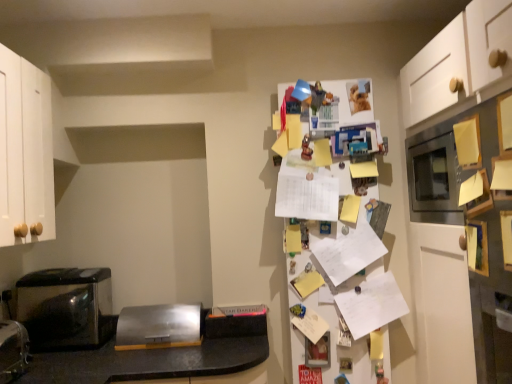
What do you see at coordinates (66, 308) in the screenshot? The image size is (512, 384). I see `metallic black toaster at left` at bounding box center [66, 308].

The width and height of the screenshot is (512, 384). I want to click on white paper covered fridge at upper right, so click(x=339, y=259).

Is point (358, 368) farther from viewer compared to point (16, 358)?

Yes, it is behind point (16, 358).

From the image's perspective, between white paper covered fridge at upper right and black stainless steel microwave at lower left, marked as the 2th appliance in a right-to-left arrangement, which one is located above?

From the image's view, white paper covered fridge at upper right is above.

Is white paper covered fridge at upper right outside of black stainless steel microwave at lower left, positioned as the first appliance in left-to-right order?

Yes.

How much distance is there between satin silver toaster at center, arranged as the first appliance when viewed from the right, and metallic black toaster at left?

satin silver toaster at center, arranged as the first appliance when viewed from the right, is 11.89 inches away from metallic black toaster at left.

From a real-world perspective, which object rests below the other?

In real-world perspective, satin silver toaster at center, which appears as the first appliance when viewed from the back, is lower.

Is satin silver toaster at center, the 2th appliance positioned from the front, bigger or smaller than metallic black toaster at left?

satin silver toaster at center, the 2th appliance positioned from the front, is smaller than metallic black toaster at left.

Is satin silver toaster at center, which is the second appliance from left to right, inside the boundaries of metallic black toaster at left, or outside?

The correct answer is: outside.

Are white paper at center and white paper covered fridge at upper right far apart?

Actually, white paper at center and white paper covered fridge at upper right are a little close together.

Can you confirm if white paper at center is thinner than white paper covered fridge at upper right?

Correct, the width of white paper at center is less than that of white paper covered fridge at upper right.

From a real-world perspective, is white paper at center beneath white paper covered fridge at upper right?

Yes.

Is black stainless steel microwave at lower left, marked as the 2th appliance in a right-to-left arrangement, aimed at metallic black toaster at left?

No, black stainless steel microwave at lower left, marked as the 2th appliance in a right-to-left arrangement, is not oriented towards metallic black toaster at left.

Locate an element on the screen. This screenshot has height=384, width=512. home appliance that is above the black stainless steel microwave at lower left, positioned as the first appliance in left-to-right order (from the image's perspective) is located at coordinates coord(66,308).

Is point (2, 377) closer or farther from the camera than point (105, 287)?

Clearly, point (2, 377) is closer to the camera than point (105, 287).

Looking at their sizes, would you say black stainless steel microwave at lower left, the 1th appliance in the front-to-back sequence, is wider or thinner than metallic black toaster at left?

Clearly, black stainless steel microwave at lower left, the 1th appliance in the front-to-back sequence, has less width compared to metallic black toaster at left.

Is black stainless steel microwave at lower left, positioned as the first appliance in left-to-right order, not near satin silver toaster at center, which appears as the first appliance when viewed from the back?

No.

Between black stainless steel microwave at lower left, positioned as the first appliance in left-to-right order, and satin silver toaster at center, which appears as the first appliance when viewed from the back, which one has larger size?

black stainless steel microwave at lower left, positioned as the first appliance in left-to-right order, is bigger.

Is satin silver toaster at center, which is the second appliance from left to right, completely or partially inside black stainless steel microwave at lower left, the 1th appliance in the front-to-back sequence?

That's incorrect, satin silver toaster at center, which is the second appliance from left to right, is not inside black stainless steel microwave at lower left, the 1th appliance in the front-to-back sequence.

From the image's perspective, which object appears higher, satin silver toaster at center, the 2th appliance positioned from the front, or white paper covered fridge at upper right?

white paper covered fridge at upper right is shown above in the image.

Who is taller, satin silver toaster at center, arranged as the first appliance when viewed from the right, or white paper covered fridge at upper right?

white paper covered fridge at upper right is taller.

Is satin silver toaster at center, arranged as the first appliance when viewed from the right, inside the boundaries of white paper covered fridge at upper right, or outside?

satin silver toaster at center, arranged as the first appliance when viewed from the right, is not enclosed by white paper covered fridge at upper right.

Is white paper covered fridge at upper right at the back of black stainless steel microwave at lower left, positioned as the first appliance in left-to-right order?

That's not correct — black stainless steel microwave at lower left, positioned as the first appliance in left-to-right order, is not looking away from white paper covered fridge at upper right.

From the image's perspective, is black stainless steel microwave at lower left, positioned as the first appliance in left-to-right order, positioned above or below white paper covered fridge at upper right?

black stainless steel microwave at lower left, positioned as the first appliance in left-to-right order, is situated lower than white paper covered fridge at upper right in the image.

Considering the positions of points (24, 349) and (313, 169), is point (24, 349) farther from camera compared to point (313, 169)?

No, it is in front of (313, 169).

From a real-world perspective, who is located higher, black stainless steel microwave at lower left, marked as the 2th appliance in a right-to-left arrangement, or white paper covered fridge at upper right?

white paper covered fridge at upper right.

From the image's perspective, which appliance is the 1st one below the white paper covered fridge at upper right? Please provide its 2D coordinates.

[(13, 350)]

The width and height of the screenshot is (512, 384). I want to click on home appliance that is behind the satin silver toaster at center, arranged as the first appliance when viewed from the right, so pos(66,308).

Estimate the real-world distances between objects in this image. Which object is closer to white paper at center, white paper covered fridge at upper right or metallic black toaster at left?

white paper covered fridge at upper right.

Based on their spatial positions, is white paper covered fridge at upper right or satin silver toaster at center, the 2th appliance positioned from the front, further from black stainless steel microwave at lower left, the 1th appliance in the front-to-back sequence?

Among the two, white paper covered fridge at upper right is located further to black stainless steel microwave at lower left, the 1th appliance in the front-to-back sequence.

In the scene shown: Which object lies nearer to the anchor point white paper at center, metallic black toaster at left or satin silver toaster at center, which appears as the first appliance when viewed from the back?

satin silver toaster at center, which appears as the first appliance when viewed from the back, lies closer to white paper at center than the other object.

In the scene shown: Estimate the real-world distances between objects in this image. Which object is closer to black stainless steel microwave at lower left, positioned as the first appliance in left-to-right order, white paper at center or satin silver toaster at center, which is the second appliance from left to right?

The object closer to black stainless steel microwave at lower left, positioned as the first appliance in left-to-right order, is satin silver toaster at center, which is the second appliance from left to right.

Based on their spatial positions, is white paper at center or satin silver toaster at center, the 2th appliance positioned from the front, further from white paper covered fridge at upper right?

satin silver toaster at center, the 2th appliance positioned from the front, is positioned further to the anchor white paper covered fridge at upper right.

Estimate the real-world distances between objects in this image. Which object is further from black stainless steel microwave at lower left, the 1th appliance in the front-to-back sequence, metallic black toaster at left or satin silver toaster at center, arranged as the first appliance when viewed from the right?

satin silver toaster at center, arranged as the first appliance when viewed from the right, is further to black stainless steel microwave at lower left, the 1th appliance in the front-to-back sequence.

Based on their spatial positions, is white paper covered fridge at upper right or white paper at center closer to satin silver toaster at center, which appears as the first appliance when viewed from the back?

Based on the image, white paper covered fridge at upper right appears to be nearer to satin silver toaster at center, which appears as the first appliance when viewed from the back.

In the scene shown: Based on their spatial positions, is satin silver toaster at center, which appears as the first appliance when viewed from the back, or white paper at center closer to black stainless steel microwave at lower left, the 1th appliance in the front-to-back sequence?

satin silver toaster at center, which appears as the first appliance when viewed from the back, is closer to black stainless steel microwave at lower left, the 1th appliance in the front-to-back sequence.

At what (x,y) coordinates should I click in order to perform the action: click on appliance between black stainless steel microwave at lower left, positioned as the first appliance in left-to-right order, and white paper covered fridge at upper right, in the horizontal direction. Please return your answer as a coordinate pair (x, y). The image size is (512, 384). Looking at the image, I should click on (159, 326).

Identify the location of home appliance situated between black stainless steel microwave at lower left, positioned as the first appliance in left-to-right order, and white paper covered fridge at upper right from left to right. This screenshot has height=384, width=512. coord(66,308).

You are a GUI agent. You are given a task and a screenshot of the screen. Output one action in this format:
    pyautogui.click(x=<x>, y=<y>)
    Task: Click on the appliance located between metallic black toaster at left and white paper at center in the left-right direction
    Image resolution: width=512 pixels, height=384 pixels.
    Given the screenshot: What is the action you would take?
    pyautogui.click(x=159, y=326)

Locate an element on the screen. The height and width of the screenshot is (384, 512). home appliance between black stainless steel microwave at lower left, marked as the 2th appliance in a right-to-left arrangement, and satin silver toaster at center, arranged as the first appliance when viewed from the right is located at coordinates (66, 308).